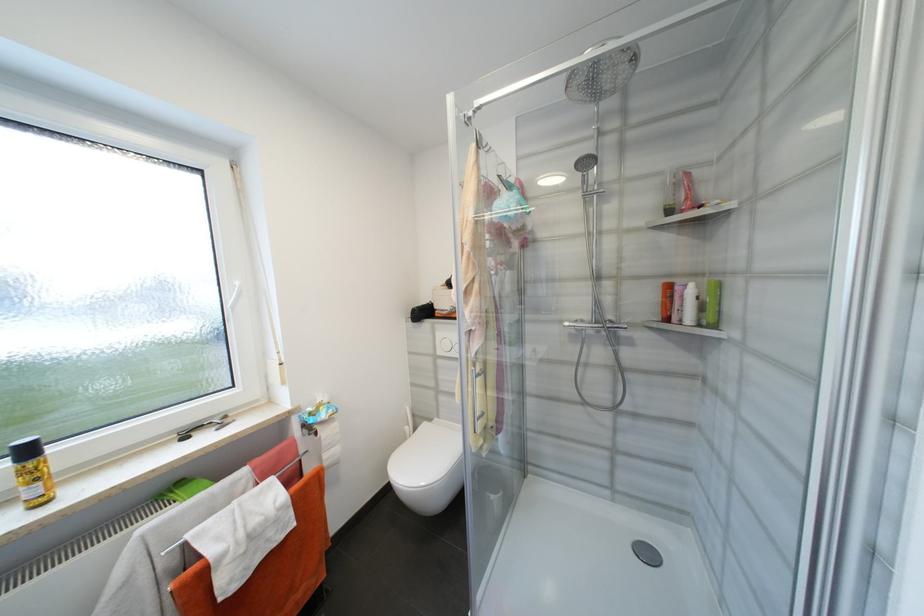
This screenshot has width=924, height=616. Identify the location of handheld shower head. (586, 163).